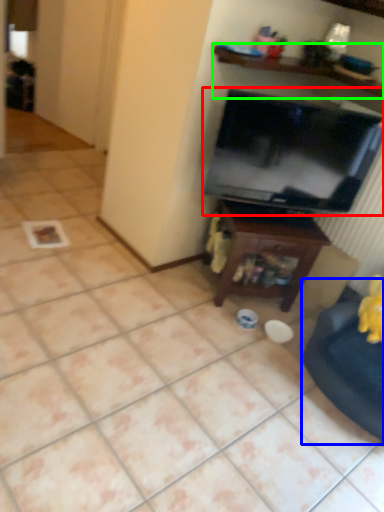
Question: Estimate the real-world distances between objects in this image. Which object is closer to television (highlighted by a red box), swivel chair (highlighted by a blue box) or shelf (highlighted by a green box)?

Choices:
 (A) swivel chair
 (B) shelf

Answer: (B)